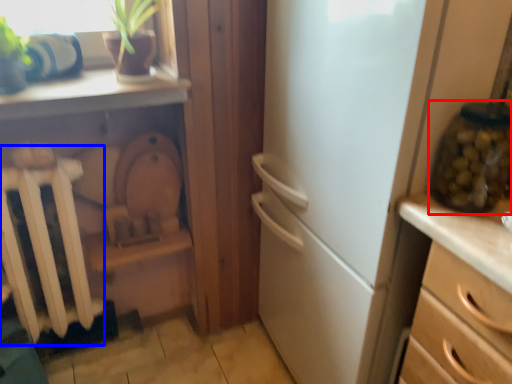
Question: Among these objects, which one is nearest to the camera, glass jar (highlighted by a red box) or radiator (highlighted by a blue box)?

Choices:
 (A) glass jar
 (B) radiator

Answer: (A)